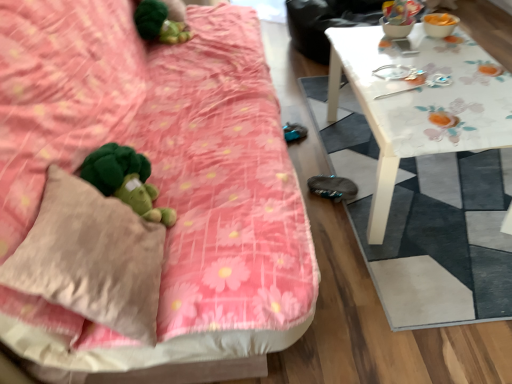
Question: Is green plush toy at lower left further to camera compared to green plush toy at upper left?

Choices:
 (A) yes
 (B) no

Answer: (B)

Question: Can you confirm if green plush toy at lower left is positioned to the right of green plush toy at upper left?

Choices:
 (A) yes
 (B) no

Answer: (A)

Question: From a real-world perspective, is green plush toy at lower left located beneath green plush toy at upper left?

Choices:
 (A) no
 (B) yes

Answer: (B)

Question: Considering the relative sizes of green plush toy at lower left and green plush toy at upper left in the image provided, is green plush toy at lower left shorter than green plush toy at upper left?

Choices:
 (A) no
 (B) yes

Answer: (A)

Question: Is green plush toy at lower left with green plush toy at upper left?

Choices:
 (A) yes
 (B) no

Answer: (B)

Question: Choose the correct answer: Is green plush toy at lower left inside white glossy table at upper right or outside it?

Choices:
 (A) outside
 (B) inside

Answer: (A)

Question: From a real-world perspective, is green plush toy at lower left positioned above or below white glossy table at upper right?

Choices:
 (A) below
 (B) above

Answer: (B)

Question: From the image's perspective, is green plush toy at lower left above or below white glossy table at upper right?

Choices:
 (A) above
 (B) below

Answer: (B)

Question: Does point (106, 162) appear closer or farther from the camera than point (452, 120)?

Choices:
 (A) closer
 (B) farther

Answer: (A)

Question: Is white glossy table at upper right in front of or behind green plush toy at lower left in the image?

Choices:
 (A) behind
 (B) front

Answer: (A)

Question: From a real-world perspective, relative to green plush toy at lower left, is white glossy table at upper right vertically above or below?

Choices:
 (A) above
 (B) below

Answer: (B)

Question: From the image's perspective, is white glossy table at upper right located above or below green plush toy at lower left?

Choices:
 (A) above
 (B) below

Answer: (A)

Question: Is white glossy table at upper right wider or thinner than green plush toy at lower left?

Choices:
 (A) thin
 (B) wide

Answer: (B)

Question: From the image's perspective, is green plush toy at upper left positioned above or below white floral-patterned mat at right?

Choices:
 (A) below
 (B) above

Answer: (B)

Question: Considering the positions of green plush toy at upper left and white floral-patterned mat at right in the image, is green plush toy at upper left bigger or smaller than white floral-patterned mat at right?

Choices:
 (A) big
 (B) small

Answer: (B)